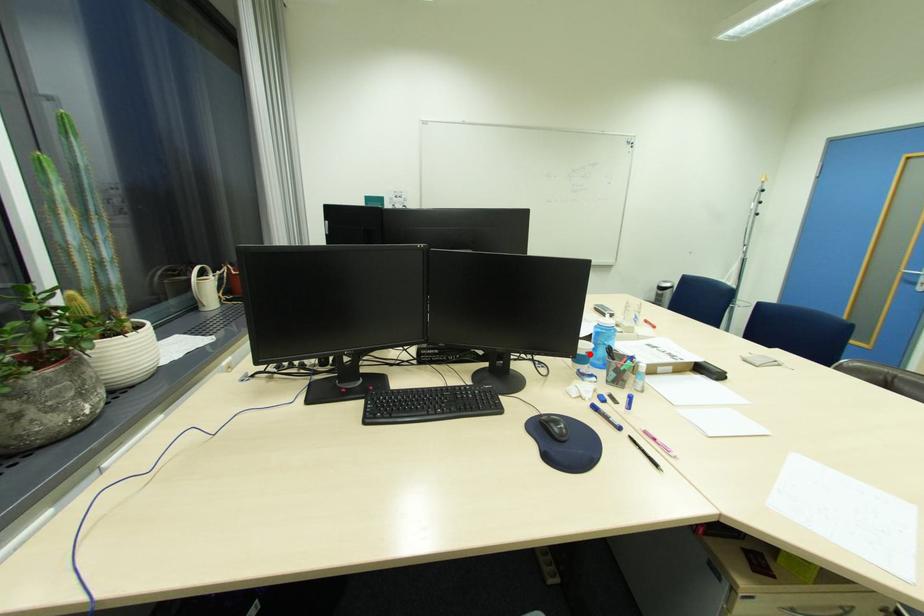
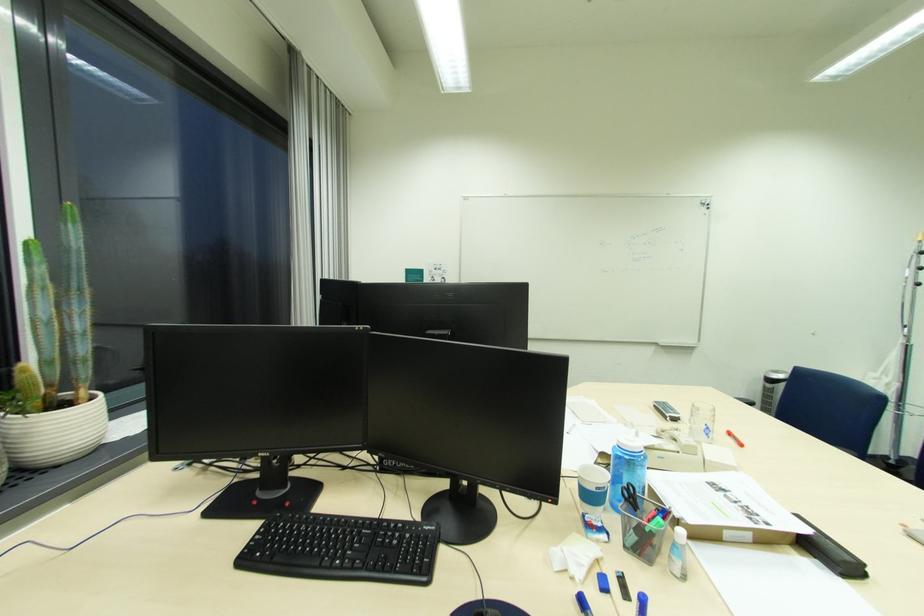
Find the pixel in the second image that matches the highlighted location in the first image.

(600, 488)